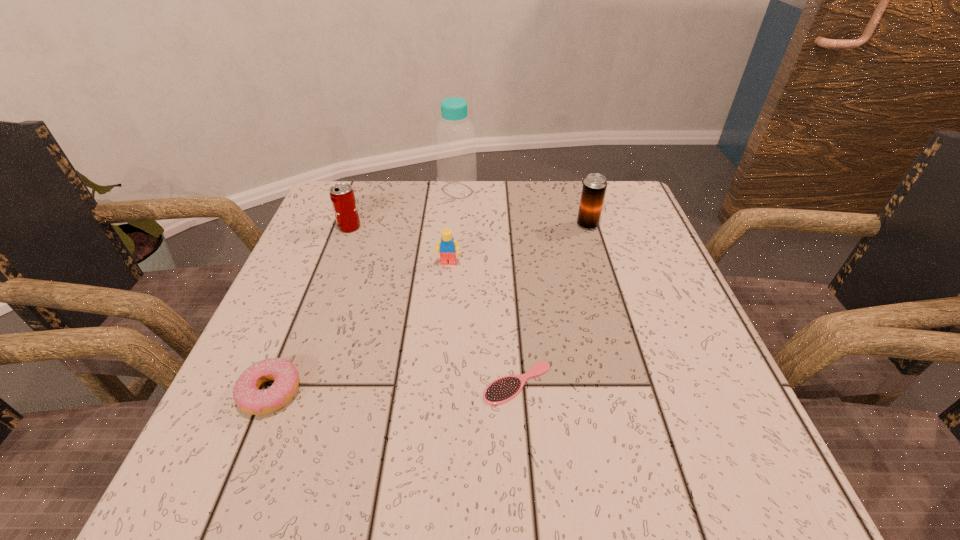
I want to click on the second object from right to left, so click(504, 389).

The width and height of the screenshot is (960, 540). Find the location of `vacant space located on the right of the farthest object`. vacant space located on the right of the farthest object is located at coordinates (497, 191).

At what (x,y) coordinates should I click in order to perform the action: click on vacant space situated 0.170m on the left of the right beer can. Please return your answer as a coordinate pair (x, y). This screenshot has width=960, height=540. Looking at the image, I should click on (505, 225).

Locate an element on the screen. vacant space located on the back of the fourth shortest object is located at coordinates (365, 186).

Locate an element on the screen. This screenshot has height=540, width=960. blank space located on the front-facing side of the Lego is located at coordinates (439, 380).

The height and width of the screenshot is (540, 960). Identify the location of vacant space located 0.280m on the right of the doughnut. (476, 393).

The image size is (960, 540). I want to click on vacant area situated on the back of the fifth object from left to right, so (x=511, y=297).

Where is `bottle that is at the far edge`? The image size is (960, 540). bottle that is at the far edge is located at coordinates (455, 146).

Where is `beer can that is at the left edge`? The image size is (960, 540). beer can that is at the left edge is located at coordinates (342, 196).

This screenshot has width=960, height=540. In order to click on doughnut situated at the left edge in this screenshot , I will do `click(249, 398)`.